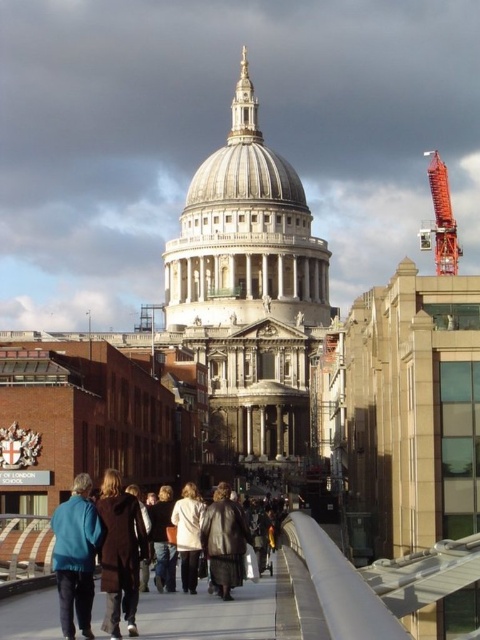
Question: Can you confirm if blue leather jacket at lower left is positioned to the right of orange metallic crane at upper right?

Choices:
 (A) no
 (B) yes

Answer: (A)

Question: Is orange metallic crane at upper right above dark blue jeans at center?

Choices:
 (A) yes
 (B) no

Answer: (A)

Question: Can you confirm if brown leather coat at center is smaller than dark blue jeans at center?

Choices:
 (A) no
 (B) yes

Answer: (B)

Question: Estimate the real-world distances between objects in this image. Which object is farther from the white matte coat at center?

Choices:
 (A) dark brown leather shoes at lower center
 (B) brown leather coat at center

Answer: (B)

Question: Which point is farther to the camera?

Choices:
 (A) (175, 513)
 (B) (239, 531)
 (C) (86, 616)
 (D) (164, 632)

Answer: (A)

Question: Among these points, which one is farthest from the camera?

Choices:
 (A) (67, 508)
 (B) (108, 618)

Answer: (A)